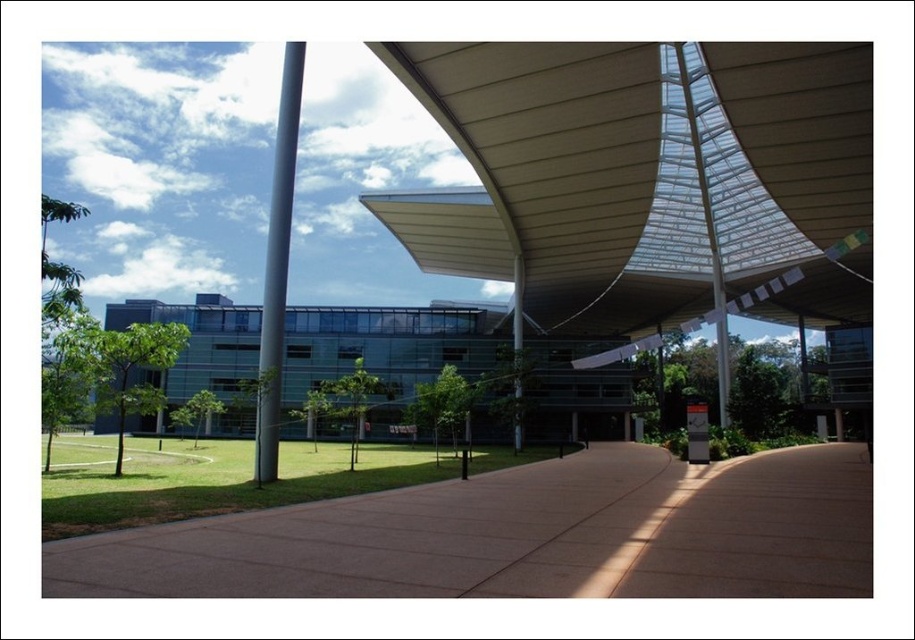
You are an architect designing a new outdoor space. You need to ensure that the white textured canopy at upper center and the satin silver pole at center do not block the view of the sky for visitors standing below. Based on their heights, which object might be more likely to obstruct the view?

The satin silver pole at center is taller than the white textured canopy at upper center, so it might be more likely to obstruct the view of the sky for visitors standing below.

You are a visitor approaching the building and want to walk along the pathway. Which object will you encounter first as you move forward towards the building? The brown concrete pavement at center or the metallic pole at center?

The metallic pole at center will be encountered first because the brown concrete pavement at center is to the right of the metallic pole at center, meaning the pole is positioned closer to the entrance path.